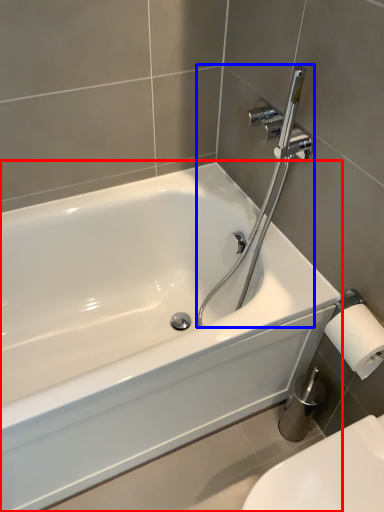
Question: Which object is closer to the camera taking this photo, bathtub (highlighted by a red box) or plumbing fixture (highlighted by a blue box)?

Choices:
 (A) bathtub
 (B) plumbing fixture

Answer: (A)